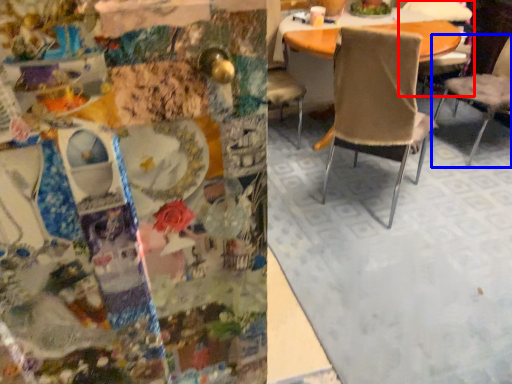
Question: Which of the following is the farthest to the observer, chair (highlighted by a red box) or chair (highlighted by a blue box)?

Choices:
 (A) chair
 (B) chair

Answer: (A)